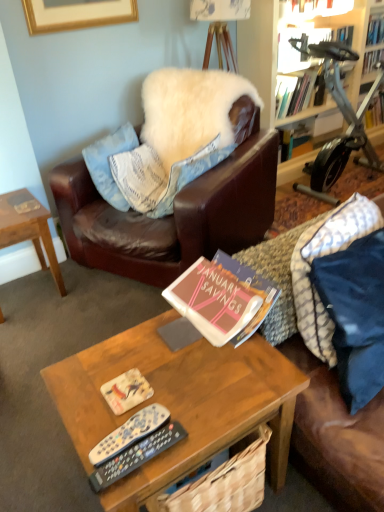
This screenshot has height=512, width=384. Find the location of `free location to the left of black plastic remote control at lower center, which is the first remote control from back to front`. free location to the left of black plastic remote control at lower center, which is the first remote control from back to front is located at coordinates (87, 419).